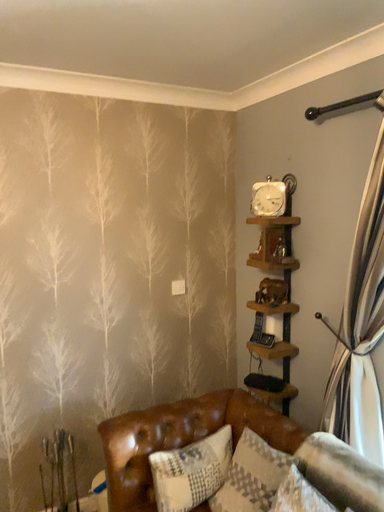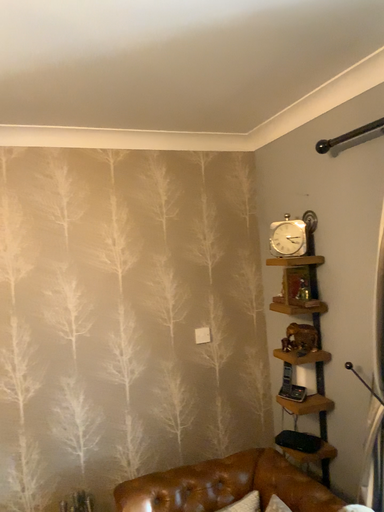
Question: How did the camera likely rotate when shooting the video?

Choices:
 (A) rotated right
 (B) rotated left

Answer: (B)